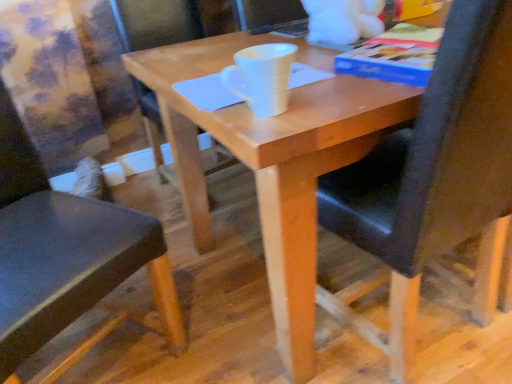
Question: Which direction should I rotate to face black leather chair at center, acting as the first chair starting from the right, — up or down?

Choices:
 (A) up
 (B) down

Answer: (A)

Question: From a real-world perspective, is blue paper at upper right physically below black leather chair at left, the 2th chair when ordered from right to left?

Choices:
 (A) no
 (B) yes

Answer: (A)

Question: Is blue paper at upper right located outside black leather chair at left, the 2th chair when ordered from right to left?

Choices:
 (A) no
 (B) yes

Answer: (B)

Question: Would you say blue paper at upper right contains black leather chair at left, which appears as the first chair when viewed from the left?

Choices:
 (A) yes
 (B) no

Answer: (B)

Question: Is blue paper at upper right closer to camera compared to black leather chair at left, the 2th chair when ordered from right to left?

Choices:
 (A) no
 (B) yes

Answer: (A)

Question: Is blue paper at upper right at the right side of black leather chair at left, the 2th chair when ordered from right to left?

Choices:
 (A) no
 (B) yes

Answer: (B)

Question: Considering the relative positions of blue paper at upper right and black leather chair at left, which appears as the first chair when viewed from the left, in the image provided, is blue paper at upper right to the left of black leather chair at left, which appears as the first chair when viewed from the left, from the viewer's perspective?

Choices:
 (A) no
 (B) yes

Answer: (A)

Question: Is blue paper at upper right looking in the opposite direction of wooden table at center?

Choices:
 (A) yes
 (B) no

Answer: (B)

Question: Can you confirm if blue paper at upper right is smaller than wooden table at center?

Choices:
 (A) yes
 (B) no

Answer: (A)

Question: Is blue paper at upper right bigger than wooden table at center?

Choices:
 (A) yes
 (B) no

Answer: (B)

Question: Considering the relative sizes of blue paper at upper right and wooden table at center in the image provided, is blue paper at upper right thinner than wooden table at center?

Choices:
 (A) yes
 (B) no

Answer: (A)

Question: From a real-world perspective, is blue paper at upper right on top of wooden table at center?

Choices:
 (A) no
 (B) yes

Answer: (B)

Question: From a real-world perspective, is blue paper at upper right located beneath wooden table at center?

Choices:
 (A) yes
 (B) no

Answer: (B)

Question: Is black leather chair at center, acting as the first chair starting from the right, wider than blue paper at upper right?

Choices:
 (A) no
 (B) yes

Answer: (B)